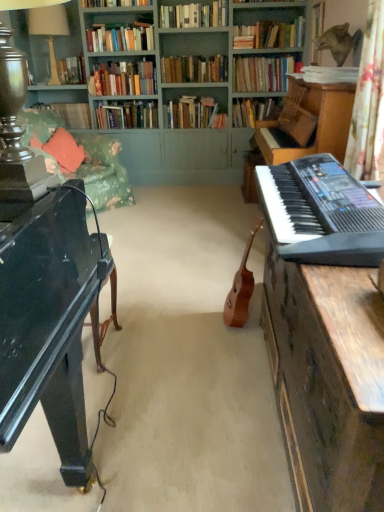
Find the location of `hardcover books at center, which ranks as the 7th book in back-to-front order`. hardcover books at center, which ranks as the 7th book in back-to-front order is located at coordinates (262, 73).

At what (x,y) coordinates should I click in order to perform the action: click on white paper at upper right, which ranks as the 11th book in back-to-front order. Please return your answer as a coordinate pair (x, y). Looking at the image, I should click on (329, 74).

At what (x,y) coordinates should I click in order to perform the action: click on hardcover book at upper center, the second book when ordered from front to back. Please return your answer as a coordinate pair (x, y). The image size is (384, 512). Looking at the image, I should click on (270, 34).

Find the location of a particular element. This screenshot has width=384, height=512. hardcover books at center, which appears as the 5th book when viewed from the back is located at coordinates tap(194, 69).

Identify the location of hardcover books at upper center, the 8th book in the back-to-front sequence. (120, 38).

From a real-world perspective, between hardcover books at center, the seventh book from the front, and black plastic keyboard at right, who is vertically lower?

black plastic keyboard at right, from a real-world perspective.

Who is more distant, hardcover books at center, the seventh book from the front, or black plastic keyboard at right?

hardcover books at center, the seventh book from the front, is more distant.

Is hardcover books at center, which appears as the 5th book when viewed from the back, aimed at black plastic keyboard at right?

Yes, hardcover books at center, which appears as the 5th book when viewed from the back, faces towards black plastic keyboard at right.

Would you consider hardcover books at upper center, acting as the 4th book starting from the front, to be distant from black plastic keyboard at right?

That's right, there is a large distance between hardcover books at upper center, acting as the 4th book starting from the front, and black plastic keyboard at right.

Measure the distance between hardcover books at upper center, acting as the 4th book starting from the front, and black plastic keyboard at right.

10.42 feet.

Can you confirm if hardcover books at upper center, the 8th book in the back-to-front sequence, is positioned to the right of black plastic keyboard at right?

No, hardcover books at upper center, the 8th book in the back-to-front sequence, is not to the right of black plastic keyboard at right.

Can you tell me how much hardcover books at upper center, the 8th book in the back-to-front sequence, and black plastic keyboard at right differ in facing direction?

They differ by 92.5 degrees in their facing directions.

From the image's perspective, is wooden piano at right below light brown wood guitar at center?

Indeed, from the image's perspective, wooden piano at right is shown beneath light brown wood guitar at center.

The image size is (384, 512). Find the location of `guitar that appears behind the wooden piano at right`. guitar that appears behind the wooden piano at right is located at coordinates (241, 289).

Which is correct: wooden piano at right is inside light brown wood guitar at center, or outside of it?

wooden piano at right is spatially situated outside light brown wood guitar at center.

Which is farther, (352,411) or (248,286)?

The point (248,286) is behind.

I want to click on the 5th book counting from the right of the hardcover book at upper left, the 1th book positioned from the back, so click(194, 15).

Would you say hardcover books at upper center, acting as the third book starting from the front, is to the left or to the right of hardcover book at upper left, which is counted as the eleventh book, starting from the front, in the picture?

hardcover books at upper center, acting as the third book starting from the front, is to the right of hardcover book at upper left, which is counted as the eleventh book, starting from the front.

Would you say hardcover books at upper center, acting as the third book starting from the front, is outside hardcover book at upper left, which is counted as the eleventh book, starting from the front?

Yes, hardcover books at upper center, acting as the third book starting from the front, is located beyond the bounds of hardcover book at upper left, which is counted as the eleventh book, starting from the front.

Based on the photo, is hardcover book at upper center, the second book when ordered from front to back, a part of hardcover books at center, the seventh book from the front?

No, hardcover book at upper center, the second book when ordered from front to back, is located outside of hardcover books at center, the seventh book from the front.

Between hardcover books at center, the seventh book from the front, and hardcover book at upper center, the tenth book from the back, which one appears on the right side from the viewer's perspective?

Positioned to the right is hardcover book at upper center, the tenth book from the back.

The width and height of the screenshot is (384, 512). Identify the location of the 5th book to the right of the hardcover books at center, which appears as the 5th book when viewed from the back, starting your count from the anchor. (270, 34).

From a real-world perspective, relative to hardcover book at upper center, the second book when ordered from front to back, is hardcover books at center, the seventh book from the front, vertically above or below?

From a real-world perspective, hardcover books at center, the seventh book from the front, is physically below hardcover book at upper center, the second book when ordered from front to back.

Does black plastic keyboard at right turn towards hardcover book at upper left, which is counted as the eleventh book, starting from the front?

No, black plastic keyboard at right is not oriented towards hardcover book at upper left, which is counted as the eleventh book, starting from the front.

From the image's perspective, is black plastic keyboard at right over hardcover book at upper left, which is counted as the eleventh book, starting from the front?

No, from the image's perspective, black plastic keyboard at right is not above hardcover book at upper left, which is counted as the eleventh book, starting from the front.

Is black plastic keyboard at right behind hardcover book at upper left, which is counted as the eleventh book, starting from the front?

No, black plastic keyboard at right is in front of hardcover book at upper left, which is counted as the eleventh book, starting from the front.

Can you confirm if hardcover books at upper center, which is the sixth book in front-to-back order, is taller than hardcover book at center, positioned as the 8th book in front-to-back order?

Correct, hardcover books at upper center, which is the sixth book in front-to-back order, is much taller as hardcover book at center, positioned as the 8th book in front-to-back order.

In the scene shown: Do you think hardcover books at upper center, which is the 6th book from back to front, is within hardcover book at center, positioned as the 8th book in front-to-back order, or outside of it?

hardcover books at upper center, which is the 6th book from back to front, exists outside the volume of hardcover book at center, positioned as the 8th book in front-to-back order.

Between hardcover books at upper center, which is the 6th book from back to front, and hardcover book at center, positioned as the 8th book in front-to-back order, which one is positioned in front?

hardcover books at upper center, which is the 6th book from back to front, is more forward.

From a real-world perspective, is hardcover books at upper center, which is the 6th book from back to front, physically below hardcover book at center, positioned as the 4th book in back-to-front order?

No, from a real-world perspective, hardcover books at upper center, which is the 6th book from back to front, is not beneath hardcover book at center, positioned as the 4th book in back-to-front order.

The width and height of the screenshot is (384, 512). Find the location of `musical keyboard in front of the hardcover books at center, the seventh book from the front`. musical keyboard in front of the hardcover books at center, the seventh book from the front is located at coordinates (321, 213).

Locate an element on the screen. musical keyboard located underneath the hardcover books at upper center, acting as the 4th book starting from the front (from a real-world perspective) is located at coordinates (321, 213).

Looking at the image, which one is located further to floral fabric curtain at right, wooden piano at right or hardcover books at upper center, which is the 6th book from back to front?

Based on the image, hardcover books at upper center, which is the 6th book from back to front, appears to be further to floral fabric curtain at right.

Estimate the real-world distances between objects in this image. Which object is closer to hardcover book at upper left, the 1th book positioned from the back, floral fabric couch at upper left or hardcover books at center, positioned as the 10th book in front-to-back order?

hardcover books at center, positioned as the 10th book in front-to-back order.

In the scene shown: Which object lies nearer to the anchor point floral fabric couch at upper left, hardcover books at center, which ranks as the 7th book in back-to-front order, or white paper at upper right, which ranks as the 11th book in back-to-front order?

Among the two, hardcover books at center, which ranks as the 7th book in back-to-front order, is located nearer to floral fabric couch at upper left.

From the image, which object appears to be nearer to hardcover book at center, positioned as the 8th book in front-to-back order, black plastic keyboard at right or hardcover books at upper center, marked as the 9th book in a back-to-front arrangement?

hardcover books at upper center, marked as the 9th book in a back-to-front arrangement, is closer to hardcover book at center, positioned as the 8th book in front-to-back order.

Based on their spatial positions, is white glossy table lamp at upper left or floral fabric curtain at right further from green painted wood bookcase at upper center?

floral fabric curtain at right is positioned further to the anchor green painted wood bookcase at upper center.

Which object lies nearer to the anchor point wooden piano at right, floral fabric couch at upper left or hardcover books at upper center, acting as the 4th book starting from the front?

The object closer to wooden piano at right is floral fabric couch at upper left.

Based on their spatial positions, is floral fabric curtain at right or hardcover book at center, positioned as the 8th book in front-to-back order, further from hardcover books at center, which is counted as the second book, starting from the back?

Among the two, floral fabric curtain at right is located further to hardcover books at center, which is counted as the second book, starting from the back.

When comparing their distances from hardcover books at upper center, marked as the 9th book in a back-to-front arrangement, does hardcover book at upper center, the tenth book from the back, or white glossy table lamp at upper left seem further?

Based on the image, white glossy table lamp at upper left appears to be further to hardcover books at upper center, marked as the 9th book in a back-to-front arrangement.

Find the location of a particular element. This screenshot has width=384, height=512. guitar positioned between wooden piano at right and hardcover book at upper center, the second book when ordered from front to back, from near to far is located at coordinates (241, 289).

Locate an element on the screen. The width and height of the screenshot is (384, 512). lamp between wooden piano at right and hardcover book at upper center, the tenth book from the back, from front to back is located at coordinates (17, 131).

I want to click on curtain located between matte black lamp at left and hardcover books at upper center, the 8th book in the back-to-front sequence, in the depth direction, so click(x=368, y=101).

Find the location of a particular element. Image resolution: width=384 pixels, height=512 pixels. bookcase between matte black lamp at left and hardcover books at upper center, which is the sixth book in front-to-back order, in the front-back direction is located at coordinates (178, 94).